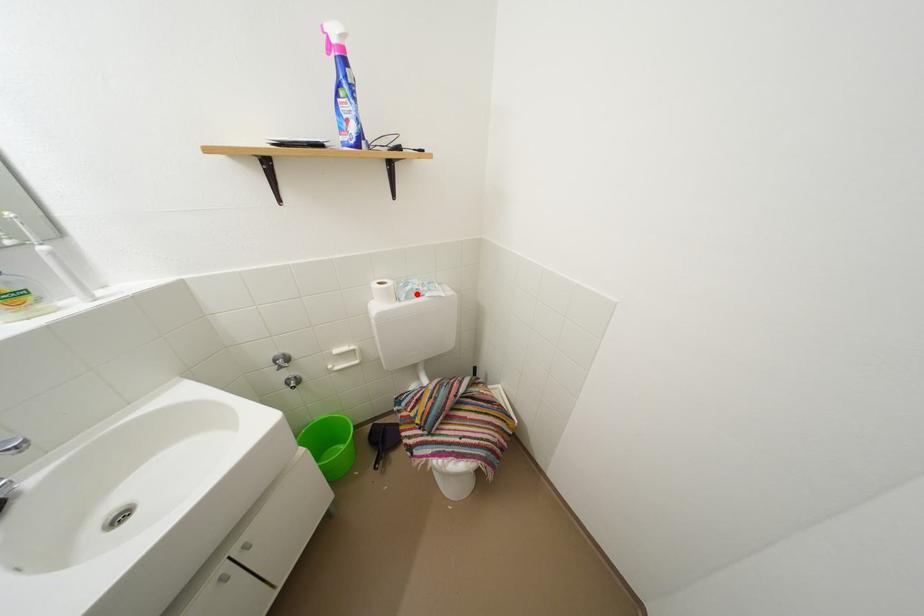
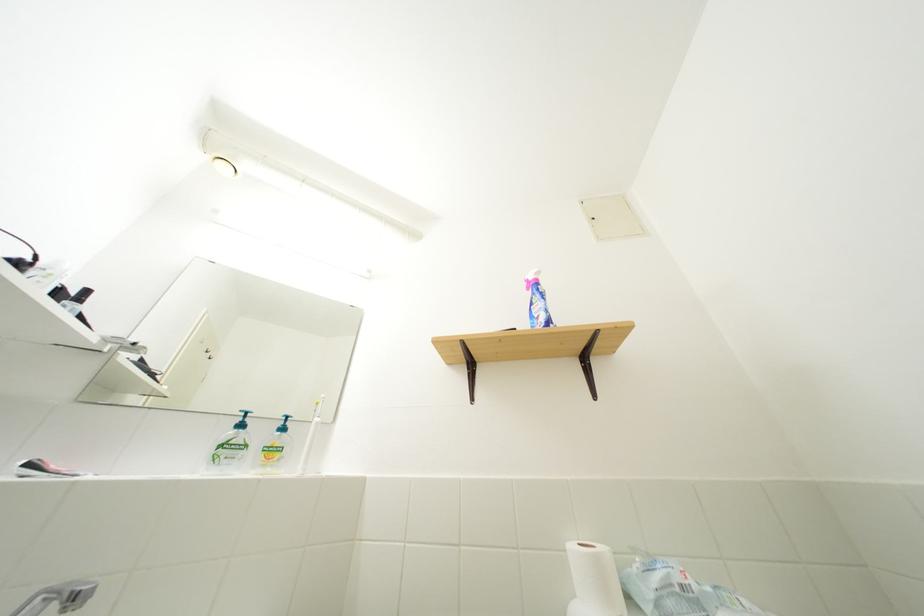
The point at the highlighted location is marked in the first image. Where is the corresponding point in the second image?

(665, 585)